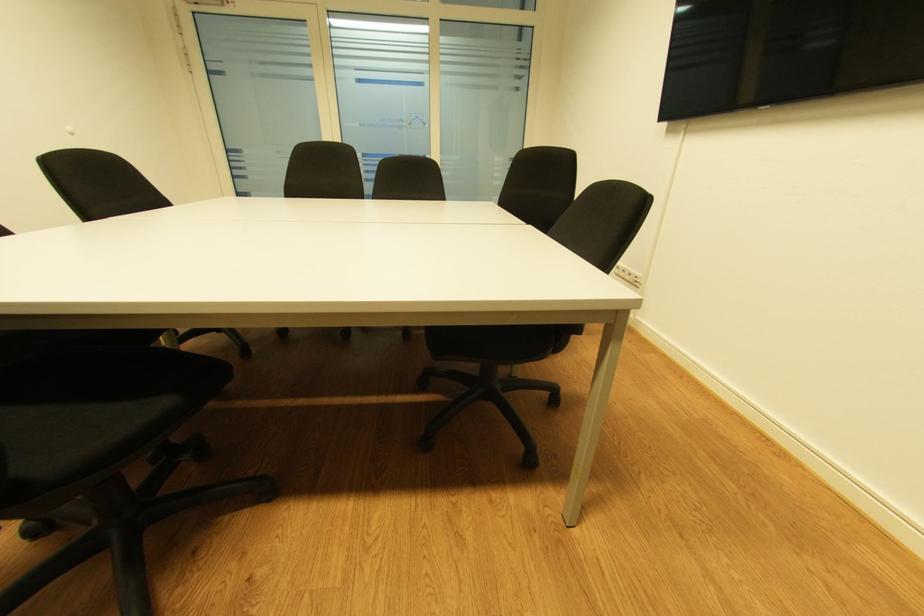
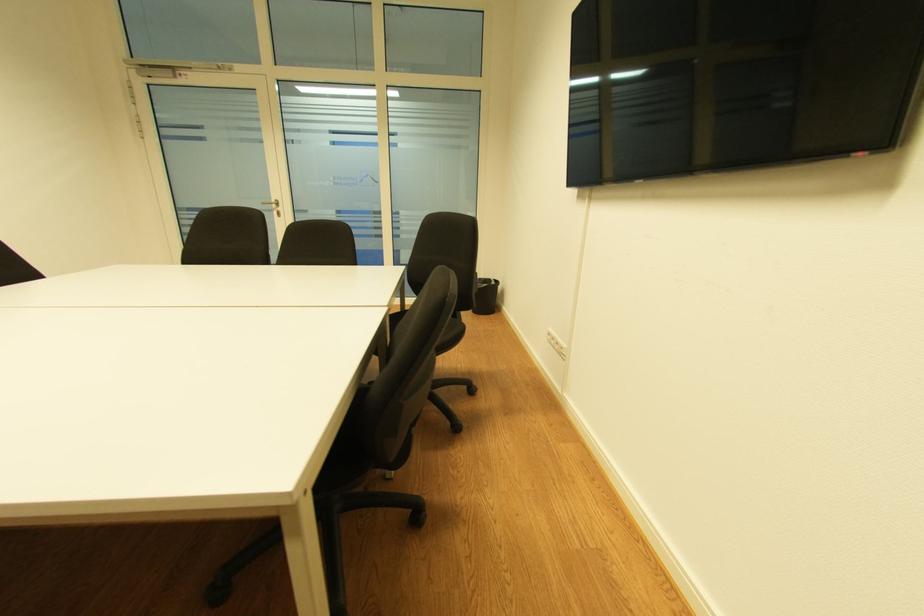
Question: The images are taken continuously from a first-person perspective. In which direction are you moving?

Choices:
 (A) Left
 (B) Right
 (C) Forward
 (D) Backward

Answer: (B)